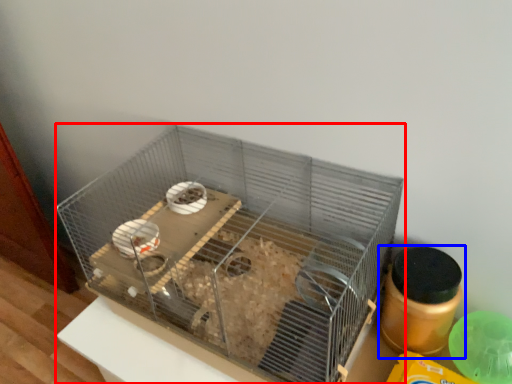
Question: Which of the following is the farthest to the observer, bird cage (highlighted by a red box) or bottle (highlighted by a blue box)?

Choices:
 (A) bird cage
 (B) bottle

Answer: (B)